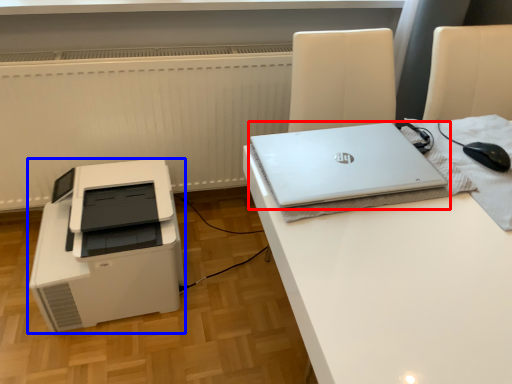
Question: Which of the following is the closest to the observer, laptop (highlighted by a red box) or printer (highlighted by a blue box)?

Choices:
 (A) laptop
 (B) printer

Answer: (A)